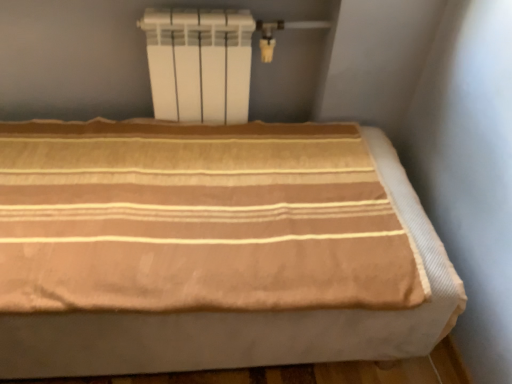
The height and width of the screenshot is (384, 512). What do you see at coordinates (211, 249) in the screenshot? I see `beige striped fabric bed at center` at bounding box center [211, 249].

What are the coordinates of `beige striped fabric bed at center` in the screenshot? It's located at (211, 249).

Describe the element at coordinates (199, 63) in the screenshot. I see `white matte radiator at upper center` at that location.

What is the approximate height of white matte radiator at upper center?

14.09 inches.

Image resolution: width=512 pixels, height=384 pixels. In order to click on white matte radiator at upper center in this screenshot , I will do `click(199, 63)`.

Locate an element on the screen. beige striped fabric bed at center is located at coordinates (211, 249).

Considering the relative positions of white matte radiator at upper center and beige striped fabric bed at center in the image provided, is white matte radiator at upper center to the left of beige striped fabric bed at center from the viewer's perspective?

No.

Is white matte radiator at upper center further to camera compared to beige striped fabric bed at center?

Yes, white matte radiator at upper center is behind beige striped fabric bed at center.

Between point (241, 30) and point (276, 356), which one is positioned in front?

The point (276, 356) is closer to the camera.

From the image's perspective, between white matte radiator at upper center and beige striped fabric bed at center, which one is located above?

white matte radiator at upper center, from the image's perspective.

From a real-world perspective, is white matte radiator at upper center positioned over beige striped fabric bed at center based on gravity?

Yes, from a real-world perspective, white matte radiator at upper center is above beige striped fabric bed at center.

Considering the relative sizes of white matte radiator at upper center and beige striped fabric bed at center in the image provided, is white matte radiator at upper center thinner than beige striped fabric bed at center?

Correct, the width of white matte radiator at upper center is less than that of beige striped fabric bed at center.

In the scene shown: Is white matte radiator at upper center shorter than beige striped fabric bed at center?

Yes, white matte radiator at upper center is shorter than beige striped fabric bed at center.

Based on the photo, is white matte radiator at upper center smaller than beige striped fabric bed at center?

Indeed, white matte radiator at upper center has a smaller size compared to beige striped fabric bed at center.

Consider the image. Could beige striped fabric bed at center be considered to be inside white matte radiator at upper center?

No, beige striped fabric bed at center is located outside of white matte radiator at upper center.

Is white matte radiator at upper center not near beige striped fabric bed at center?

They are positioned close to each other.

Is white matte radiator at upper center oriented away from beige striped fabric bed at center?

white matte radiator at upper center is not turned away from beige striped fabric bed at center.

Looking at this image, what's the angular difference between white matte radiator at upper center and beige striped fabric bed at center's facing directions?

white matte radiator at upper center and beige striped fabric bed at center are facing 0.435 degrees away from each other.

How far apart are white matte radiator at upper center and beige striped fabric bed at center?

They are 16.39 inches apart.

Find the location of a particular element. The height and width of the screenshot is (384, 512). bed that appears on the left of white matte radiator at upper center is located at coordinates (211, 249).

Between beige striped fabric bed at center and white matte radiator at upper center, which one appears on the left side from the viewer's perspective?

beige striped fabric bed at center is more to the left.

Is beige striped fabric bed at center closer to camera compared to white matte radiator at upper center?

Yes, beige striped fabric bed at center is in front of white matte radiator at upper center.

Is point (42, 207) farther from viewer compared to point (197, 55)?

That is False.

Consider the image. From the image's perspective, which is above, beige striped fabric bed at center or white matte radiator at upper center?

white matte radiator at upper center is shown above in the image.

From a real-world perspective, which is physically below, beige striped fabric bed at center or white matte radiator at upper center?

From a 3D spatial view, beige striped fabric bed at center is below.

Is beige striped fabric bed at center wider or thinner than white matte radiator at upper center?

Considering their sizes, beige striped fabric bed at center looks broader than white matte radiator at upper center.

Considering the sizes of beige striped fabric bed at center and white matte radiator at upper center in the image, is beige striped fabric bed at center taller or shorter than white matte radiator at upper center?

beige striped fabric bed at center is taller than white matte radiator at upper center.

Considering the sizes of beige striped fabric bed at center and white matte radiator at upper center in the image, is beige striped fabric bed at center bigger or smaller than white matte radiator at upper center?

Considering their sizes, beige striped fabric bed at center takes up more space than white matte radiator at upper center.

Which is correct: beige striped fabric bed at center is inside white matte radiator at upper center, or outside of it?

beige striped fabric bed at center is not inside white matte radiator at upper center, it's outside.

Are beige striped fabric bed at center and white matte radiator at upper center beside each other?

No.

Is beige striped fabric bed at center oriented towards white matte radiator at upper center?

No, beige striped fabric bed at center is not facing towards white matte radiator at upper center.

What's the angular difference between beige striped fabric bed at center and white matte radiator at upper center's facing directions?

beige striped fabric bed at center and white matte radiator at upper center are facing 0.435 degrees away from each other.

In order to click on water heater behind the beige striped fabric bed at center in this screenshot , I will do `click(199, 63)`.

Where is `water heater on the right of beige striped fabric bed at center`? This screenshot has height=384, width=512. water heater on the right of beige striped fabric bed at center is located at coordinates (199, 63).

Find the location of `water heater that appears above the beige striped fabric bed at center (from a real-world perspective)`. water heater that appears above the beige striped fabric bed at center (from a real-world perspective) is located at coordinates (199, 63).